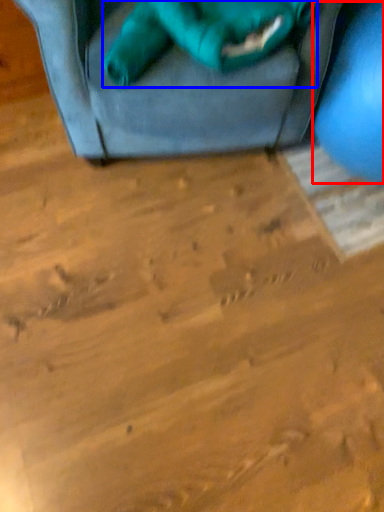
Question: Which point is closer to the camera, turquoise (highlighted by a red box) or animal (highlighted by a blue box)?

Choices:
 (A) turquoise
 (B) animal

Answer: (A)